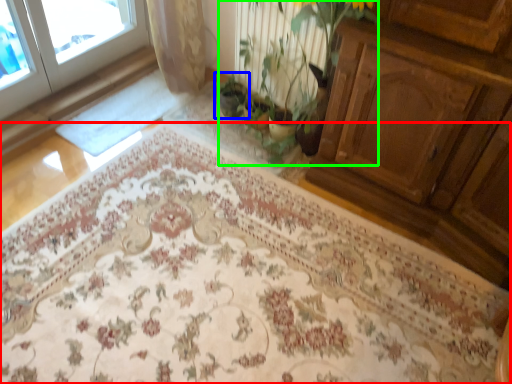
Question: Estimate the real-world distances between objects in this image. Which object is closer to mat (highlighted by a red box), houseplant (highlighted by a blue box) or floral arrangement (highlighted by a green box)?

Choices:
 (A) houseplant
 (B) floral arrangement

Answer: (B)